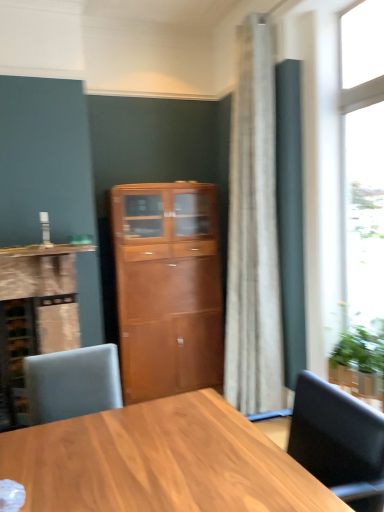
Question: Considering the relative positions of matte wood cabinet at left and white marble countertop at left in the image provided, is matte wood cabinet at left to the left or to the right of white marble countertop at left?

Choices:
 (A) right
 (B) left

Answer: (B)

Question: Which is correct: matte wood cabinet at left is inside white marble countertop at left, or outside of it?

Choices:
 (A) outside
 (B) inside

Answer: (A)

Question: Which is farther from the wooden cabinet at center?

Choices:
 (A) white marble countertop at left
 (B) matte wood cabinet at left
 (C) transparent glass window at right

Answer: (C)

Question: Which object is the farthest from the transparent glass window at right?

Choices:
 (A) wooden cabinet at center
 (B) white marble countertop at left
 (C) matte wood cabinet at left

Answer: (C)